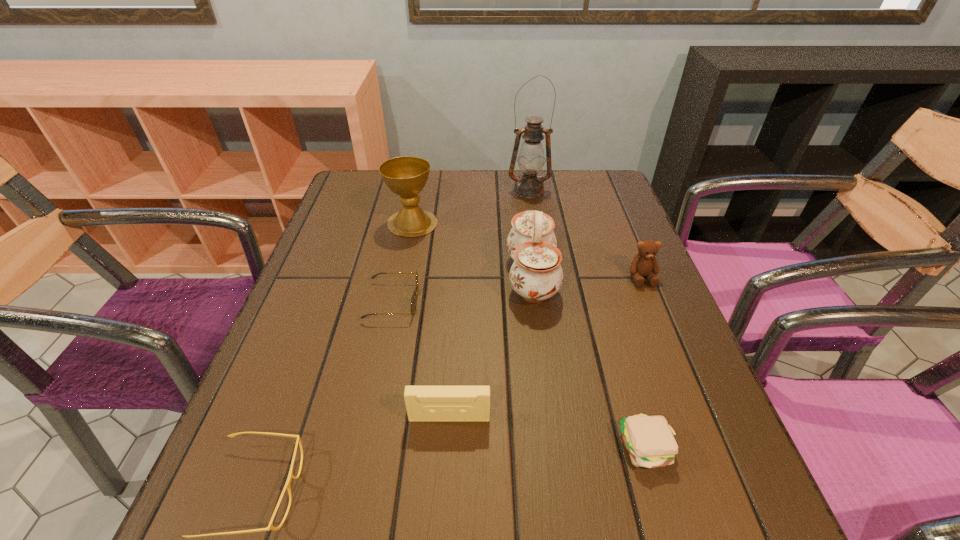
You are a GUI agent. You are given a task and a screenshot of the screen. Output one action in this format:
    pyautogui.click(x=<x>, y=<y>)
    Task: Click on the oil lamp
    The height and width of the screenshot is (540, 960).
    Given the screenshot: What is the action you would take?
    pyautogui.click(x=531, y=159)

Locate an element on the screen. This screenshot has height=540, width=960. the tallest object is located at coordinates (531, 159).

This screenshot has height=540, width=960. Identify the location of chinaware. (536, 274).

Image resolution: width=960 pixels, height=540 pixels. What are the coordinates of `the seventh nearest object` in the screenshot? It's located at (406, 176).

The width and height of the screenshot is (960, 540). What are the coordinates of `teddy bear` in the screenshot? It's located at (644, 264).

This screenshot has height=540, width=960. I want to click on the fourth tallest object, so click(x=644, y=264).

Where is `the fourth shortest object`? The height and width of the screenshot is (540, 960). the fourth shortest object is located at coordinates (423, 403).

Image resolution: width=960 pixels, height=540 pixels. In order to click on sunglasses in this screenshot , I will do `click(413, 305)`.

Identify the location of the seventh object from left to right. The height and width of the screenshot is (540, 960). (650, 441).

Identify the location of free space located 0.200m on the front of the tallest object. (537, 241).